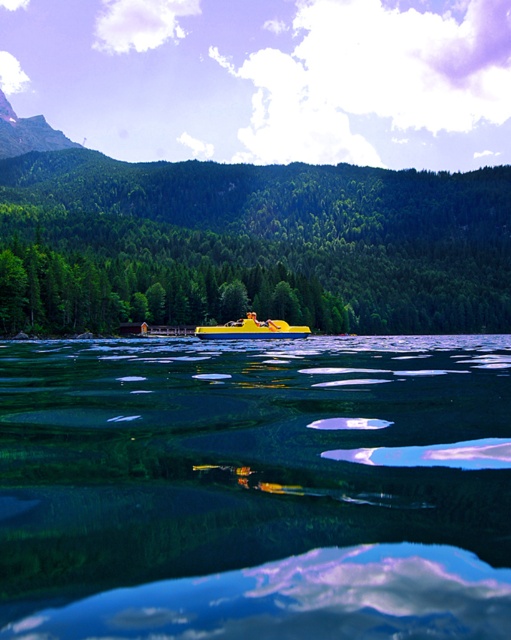
Who is more distant from viewer, (120, 477) or (495, 285)?

Point (495, 285)

Is point (202, 460) positioned before point (227, 189)?

Yes.

The height and width of the screenshot is (640, 511). What are the coordinates of `yellow plastic boat at upper center` in the screenshot? It's located at (256, 486).

Is point (140, 177) positioned in front of point (276, 328)?

No, it is not.

Measure the distance between point (100, 243) and camera.

The distance of point (100, 243) from camera is 202.91 meters.

Locate an element on the screen. This screenshot has height=640, width=511. green matte tree at center is located at coordinates (290, 227).

Between yellow plastic boat at upper center and yellow matte boat at center, which one has less height?

yellow plastic boat at upper center

Between point (171, 355) and point (201, 328), which one is positioned in front?

Point (171, 355) is in front.

Where is `yellow plastic boat at upper center`? The width and height of the screenshot is (511, 640). yellow plastic boat at upper center is located at coordinates (256, 486).